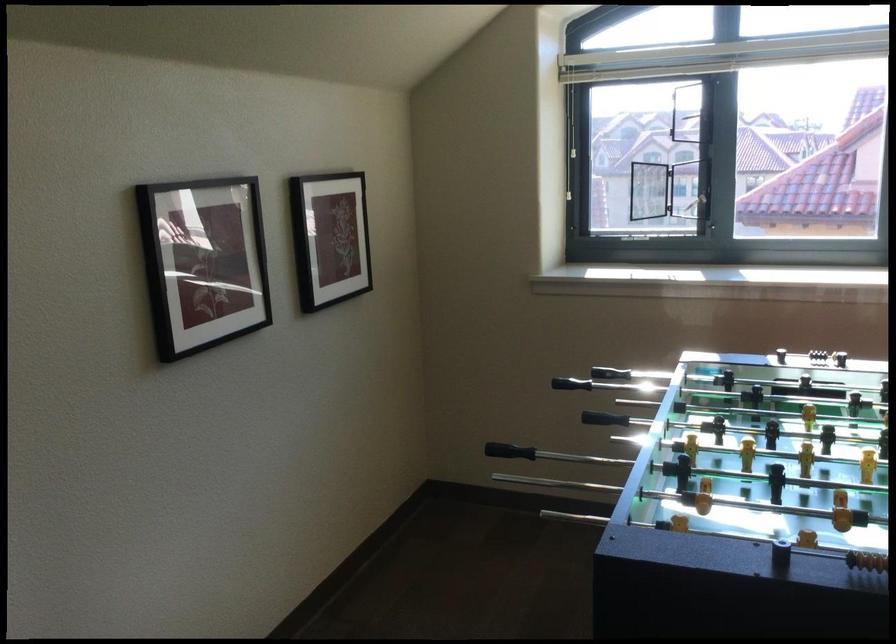
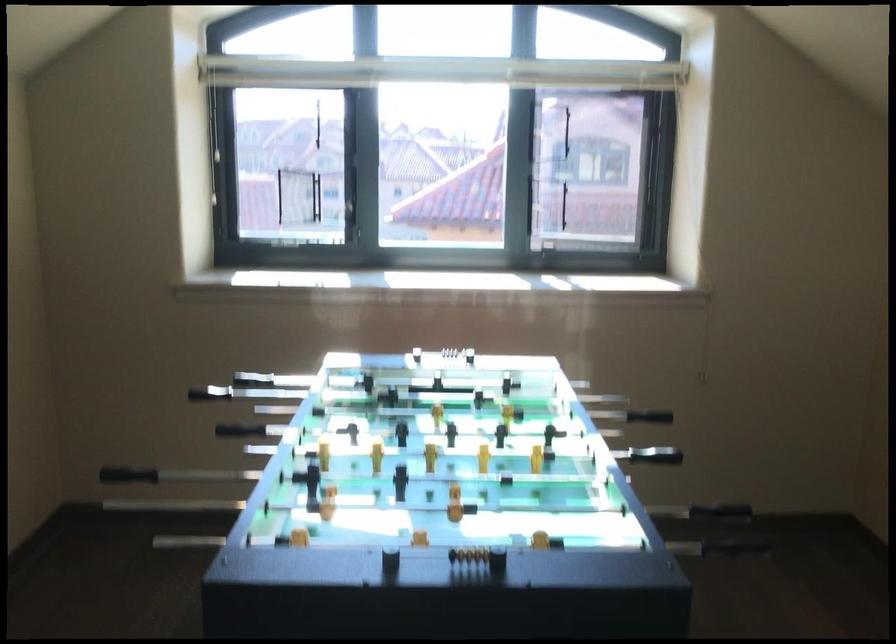
Which direction would the cameraman need to move to produce the second image?

The cameraman walked toward right, forward.